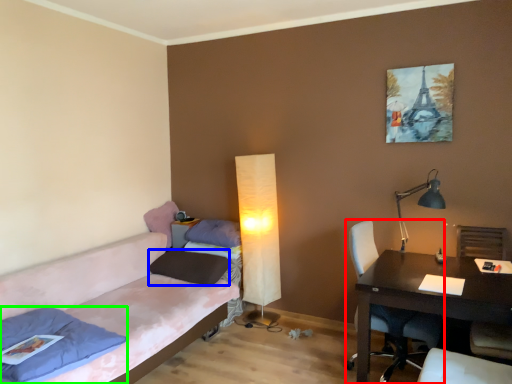
Question: Which object is positioned farthest from chair (highlighted by a red box)? Select from pillow (highlighted by a blue box) and pillow (highlighted by a green box).

Choices:
 (A) pillow
 (B) pillow

Answer: (B)